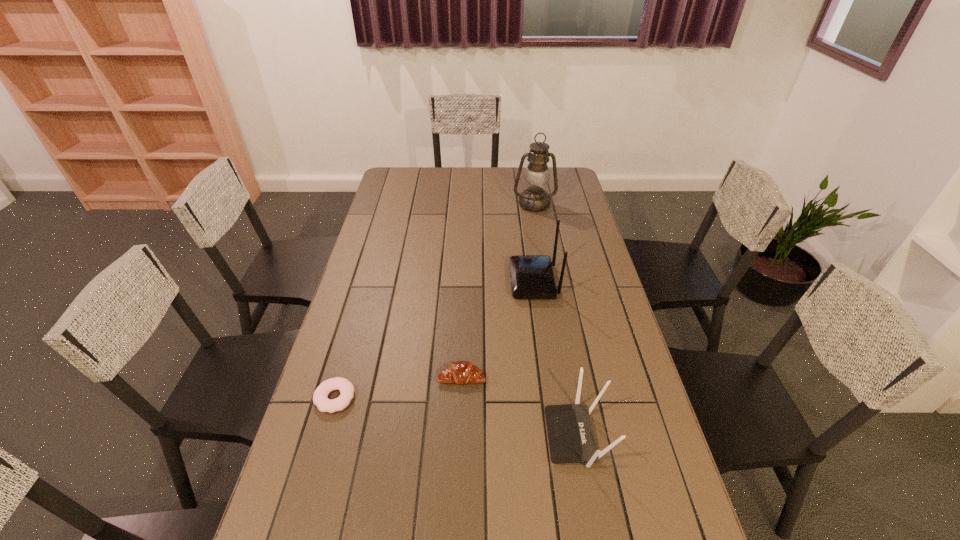
At what (x,y) coordinates should I click in order to perform the action: click on oil lamp positioned at the right edge. Please return your answer as a coordinate pair (x, y). The width and height of the screenshot is (960, 540). Looking at the image, I should click on (536, 177).

Locate an element on the screen. The image size is (960, 540). router that is at the right edge is located at coordinates (571, 440).

Locate an element on the screen. free space at the far edge is located at coordinates (467, 172).

You are a GUI agent. You are given a task and a screenshot of the screen. Output one action in this format:
    pyautogui.click(x=<x>, y=<y>)
    Task: Click on the free spot at the left edge of the desktop
    This screenshot has height=540, width=960.
    Given the screenshot: What is the action you would take?
    pyautogui.click(x=386, y=334)

I want to click on free region at the right edge of the desktop, so click(625, 427).

Locate an element on the screen. The width and height of the screenshot is (960, 540). free spot at the far right corner of the desktop is located at coordinates (553, 184).

Where is `free space that is in between the doughnut and the crescent roll`? The image size is (960, 540). free space that is in between the doughnut and the crescent roll is located at coordinates (398, 387).

Where is `free space that is in between the oil lamp and the fourth shortest object`? free space that is in between the oil lamp and the fourth shortest object is located at coordinates (534, 243).

Where is `free spot between the doughnut and the third shortest object`? free spot between the doughnut and the third shortest object is located at coordinates click(456, 417).

Where is `unoccupied area between the farther router and the shortest object`? The image size is (960, 540). unoccupied area between the farther router and the shortest object is located at coordinates (434, 340).